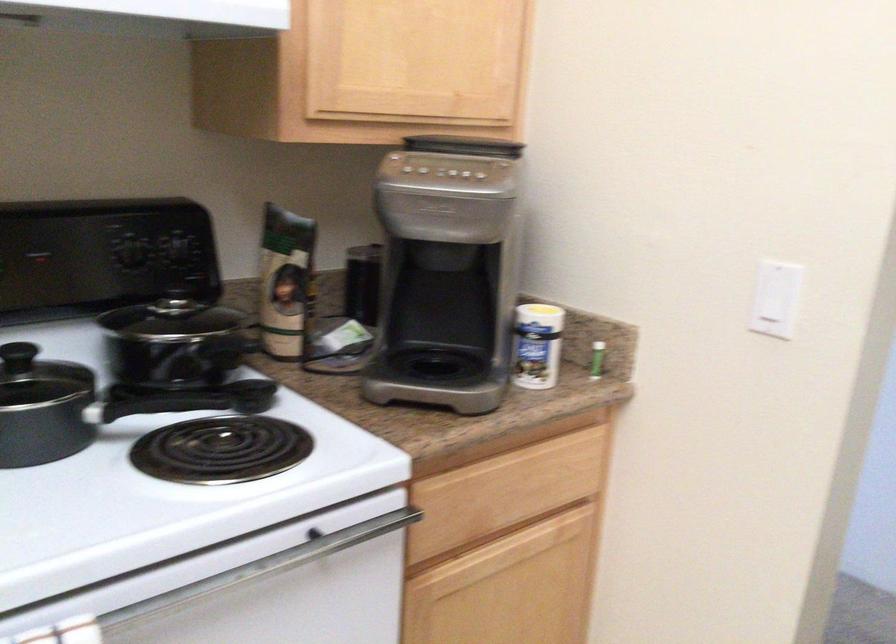
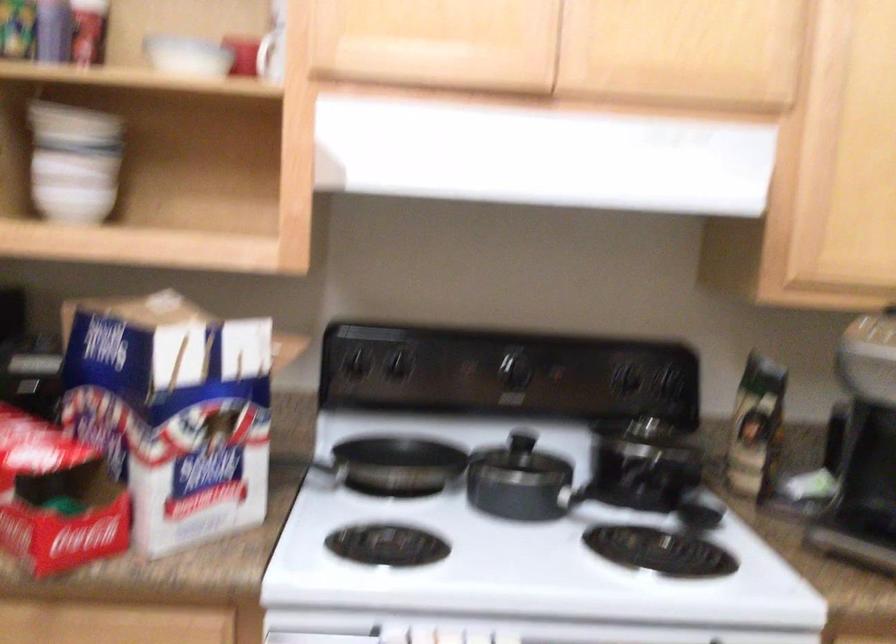
The point at (135, 250) is marked in the first image. Where is the corresponding point in the second image?

(625, 377)